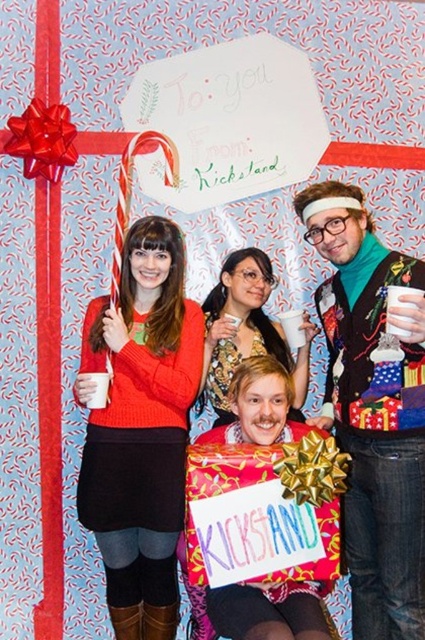
Describe the element at coordinates (141, 428) in the screenshot. This screenshot has width=425, height=640. I see `matte orange sweater at center` at that location.

In the scene shown: Is matte orange sweater at center taller than matte black sweater at center?

Yes.

Where is `matte orange sweater at center`? matte orange sweater at center is located at coordinates (141, 428).

Who is taller, matte orange sweater at center or velvet teal sweater at center?

velvet teal sweater at center is taller.

Can you confirm if matte orange sweater at center is positioned below velvet teal sweater at center?

Correct, matte orange sweater at center is located below velvet teal sweater at center.

The image size is (425, 640). Describe the element at coordinates (141, 428) in the screenshot. I see `matte orange sweater at center` at that location.

This screenshot has width=425, height=640. Find the location of `matte orange sweater at center`. matte orange sweater at center is located at coordinates (141, 428).

Is velvet teal sweater at center below matte black sweater at center?

Yes.

Describe the element at coordinates (373, 412) in the screenshot. I see `velvet teal sweater at center` at that location.

Identify the location of velvet teal sweater at center. (373, 412).